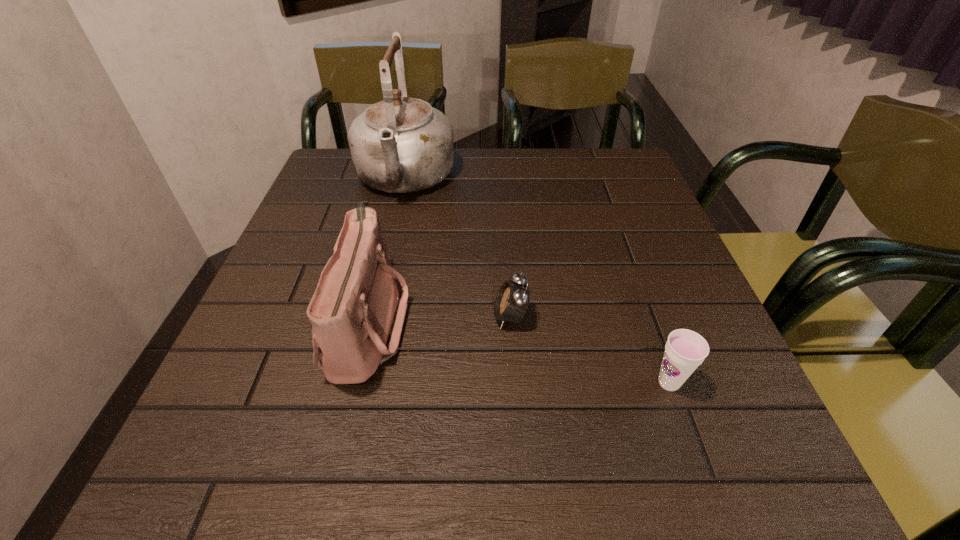
Where is `blank space located on the face of the second object from right to left`? blank space located on the face of the second object from right to left is located at coordinates (318, 317).

The height and width of the screenshot is (540, 960). In order to click on object present at the far edge in this screenshot , I will do `click(399, 145)`.

In order to click on kettle that is positioned at the left edge in this screenshot , I will do `click(399, 145)`.

At what (x,y) coordinates should I click in order to perform the action: click on shoulder bag that is at the left edge. Please return your answer as a coordinate pair (x, y). This screenshot has height=540, width=960. Looking at the image, I should click on (357, 315).

Locate an element on the screen. The width and height of the screenshot is (960, 540). object present at the right edge is located at coordinates (685, 350).

The height and width of the screenshot is (540, 960). Find the location of `object positioned at the far left corner`. object positioned at the far left corner is located at coordinates (399, 145).

You are a GUI agent. You are given a task and a screenshot of the screen. Output one action in this format:
    pyautogui.click(x=<x>, y=<y>)
    Task: Click on the free space at the far edge
    The height and width of the screenshot is (540, 960).
    Given the screenshot: What is the action you would take?
    pyautogui.click(x=482, y=188)

Find the location of a particular element. The height and width of the screenshot is (540, 960). free spot at the near edge of the desktop is located at coordinates (584, 446).

This screenshot has height=540, width=960. I want to click on free space at the left edge of the desktop, so click(246, 359).

Where is `vacant area at the right edge of the desktop`? vacant area at the right edge of the desktop is located at coordinates (624, 233).